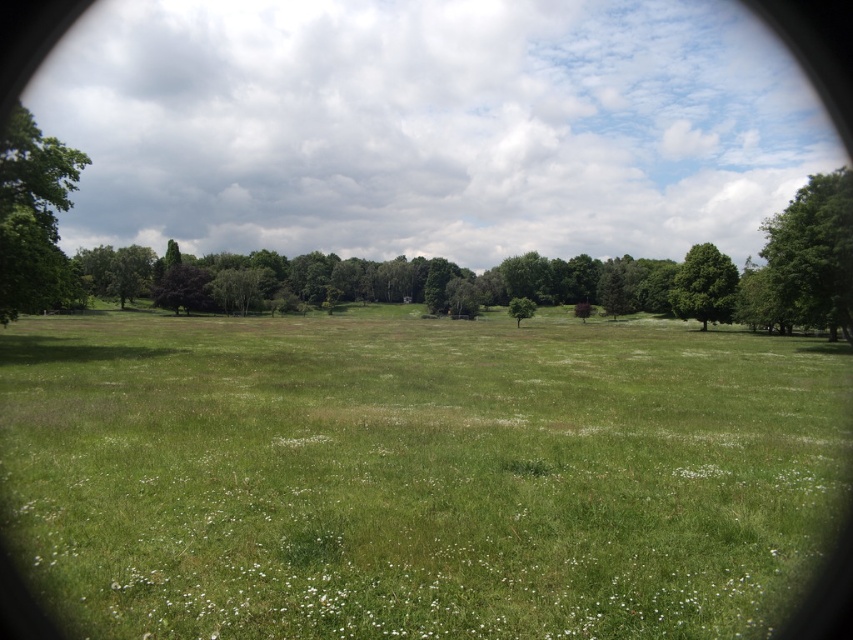
Who is more forward, [798,209] or [712,273]?

Point [798,209]

Does green leafy tree at right have a smaller size compared to green leafy tree at upper right?

No, green leafy tree at right is not smaller than green leafy tree at upper right.

Does point (844, 220) lie in front of point (698, 321)?

That is True.

The height and width of the screenshot is (640, 853). Identify the location of green leafy tree at right. [813, 252].

Which is more to the right, green leafy tree at upper right or green leafy tree at center?

green leafy tree at upper right is more to the right.

Can you confirm if green leafy tree at upper right is smaller than green leafy tree at center?

Actually, green leafy tree at upper right might be larger than green leafy tree at center.

Who is more distant from viewer, (701,314) or (527,308)?

Positioned behind is point (527,308).

Find the location of a particular element. Image resolution: width=853 pixels, height=640 pixels. green leafy tree at upper right is located at coordinates (704, 285).

Who is positioned more to the left, green leafy tree at left or green leafy tree at center?

green leafy tree at left is more to the left.

Measure the distance from green leafy tree at left to green leafy tree at center.

They are 227.94 feet apart.

At what (x,y) coordinates should I click in order to perform the action: click on green leafy tree at left. Please return your answer as a coordinate pair (x, y). This screenshot has height=640, width=853. Looking at the image, I should click on (33, 218).